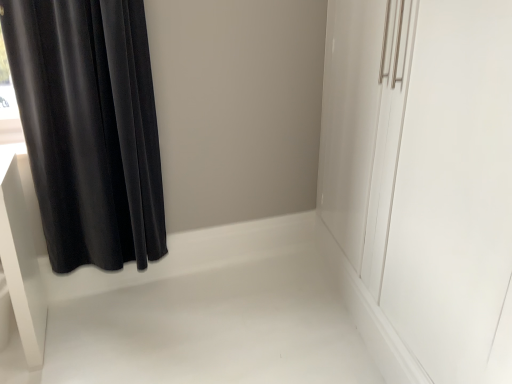
What do you see at coordinates (453, 189) in the screenshot?
I see `white glossy cabinet at right` at bounding box center [453, 189].

Where is `white glossy cabinet at right`? white glossy cabinet at right is located at coordinates (453, 189).

The height and width of the screenshot is (384, 512). What do you see at coordinates (89, 128) in the screenshot?
I see `velvet black curtain at left` at bounding box center [89, 128].

At what (x,y) coordinates should I click in order to perform the action: click on velvet black curtain at left. Please return your answer as a coordinate pair (x, y). Looking at the image, I should click on (89, 128).

At what (x,y) coordinates should I click in order to perform the action: click on white glossy cabinet at right. Please return your answer as a coordinate pair (x, y). This screenshot has height=384, width=512. Looking at the image, I should click on (453, 189).

Which is more to the left, velvet black curtain at left or white glossy cabinet at right?

velvet black curtain at left.

Looking at this image, does velvet black curtain at left lie behind white glossy cabinet at right?

Yes, velvet black curtain at left is behind white glossy cabinet at right.

Is point (110, 11) positioned behind point (471, 168)?

Yes, point (110, 11) is behind point (471, 168).

From the image's perspective, would you say velvet black curtain at left is shown under white glossy cabinet at right?

No.

From a real-world perspective, between velvet black curtain at left and white glossy cabinet at right, who is vertically lower?

white glossy cabinet at right, from a real-world perspective.

Between velvet black curtain at left and white glossy cabinet at right, which one has smaller width?

velvet black curtain at left is thinner.

Can you confirm if velvet black curtain at left is taller than white glossy cabinet at right?

Incorrect, the height of velvet black curtain at left is not larger of that of white glossy cabinet at right.

Does velvet black curtain at left have a smaller size compared to white glossy cabinet at right?

Correct, velvet black curtain at left occupies less space than white glossy cabinet at right.

Is velvet black curtain at left inside the boundaries of white glossy cabinet at right, or outside?

velvet black curtain at left is spatially situated outside white glossy cabinet at right.

Is the surface of velvet black curtain at left in direct contact with white glossy cabinet at right?

No, velvet black curtain at left is not next to white glossy cabinet at right.

Is velvet black curtain at left turned away from white glossy cabinet at right?

No.

You are a GUI agent. You are given a task and a screenshot of the screen. Output one action in this format:
    pyautogui.click(x=<x>, y=<y>)
    Task: Click on the curtain that is above the white glossy cabinet at right (from a real-world perspective)
    
    Given the screenshot: What is the action you would take?
    pyautogui.click(x=89, y=128)

Which object is positioned more to the left, white glossy cabinet at right or velvet black curtain at left?

velvet black curtain at left.

Which is in front, white glossy cabinet at right or velvet black curtain at left?

white glossy cabinet at right is more forward.

Consider the image. Which is farther from the camera, [453,334] or [69,94]?

Positioned behind is point [69,94].

From the image's perspective, is white glossy cabinet at right over velvet black curtain at left?

No.

Looking at this image, from a real-world perspective, is white glossy cabinet at right located higher than velvet black curtain at left?

Actually, white glossy cabinet at right is physically below velvet black curtain at left in the real world.

Is white glossy cabinet at right thinner than velvet black curtain at left?

No.

From the picture: Can you confirm if white glossy cabinet at right is shorter than velvet black curtain at left?

No, white glossy cabinet at right is not shorter than velvet black curtain at left.

Between white glossy cabinet at right and velvet black curtain at left, which one has smaller size?

Smaller between the two is velvet black curtain at left.

Is white glossy cabinet at right located outside velvet black curtain at left?

That's correct, white glossy cabinet at right is outside of velvet black curtain at left.

Would you say white glossy cabinet at right is a long distance from velvet black curtain at left?

Yes, white glossy cabinet at right and velvet black curtain at left are quite far apart.

Is white glossy cabinet at right aimed at velvet black curtain at left?

Yes, white glossy cabinet at right is turned towards velvet black curtain at left.

This screenshot has width=512, height=384. In the image, there is a white glossy cabinet at right. Identify the location of curtain above it (from the image's perspective). (89, 128).

At what (x,y) coordinates should I click in order to perform the action: click on curtain located above the white glossy cabinet at right (from a real-world perspective). Please return your answer as a coordinate pair (x, y). Looking at the image, I should click on (89, 128).

Identify the location of screen door beneath the velvet black curtain at left (from a real-world perspective). This screenshot has width=512, height=384. (453, 189).